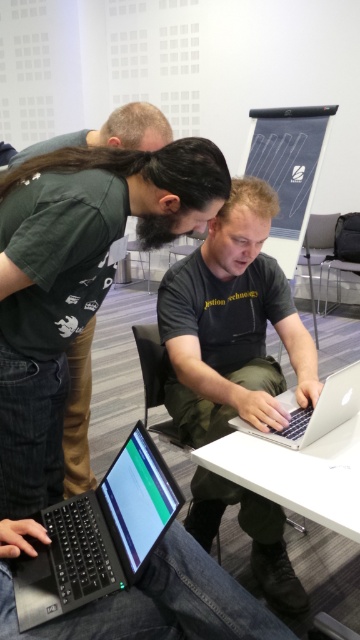
Is black matte laptop at lower left smaller than silver metallic laptop at center?

Actually, black matte laptop at lower left might be larger than silver metallic laptop at center.

Is black matte laptop at lower left closer to camera compared to silver metallic laptop at center?

Yes.

At what (x,y) coordinates should I click in order to perform the action: click on black matte laptop at lower left. Please return your answer as a coordinate pair (x, y). Looking at the image, I should click on (99, 536).

Can you confirm if matte black laptop at lower left is taller than black matte laptop at lower left?

Yes.

Is matte black laptop at lower left above black matte laptop at lower left?

Yes.

Does point (219, 179) lie behind point (141, 547)?

That is True.

The image size is (360, 640). I want to click on matte black laptop at lower left, so click(75, 280).

Is matte black laptop at center positioned in front of black matte laptop at lower left?

No.

What do you see at coordinates (231, 324) in the screenshot? I see `matte black laptop at center` at bounding box center [231, 324].

Locate an element on the screen. The image size is (360, 640). matte black laptop at center is located at coordinates (231, 324).